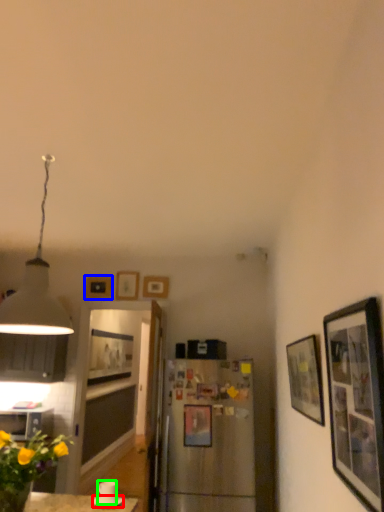
Question: Based on their relative distances, which object is farther from saucer (highlighted by a red box)? Choose from picture frame (highlighted by a blue box) and coffee cup (highlighted by a green box).

Choices:
 (A) picture frame
 (B) coffee cup

Answer: (A)